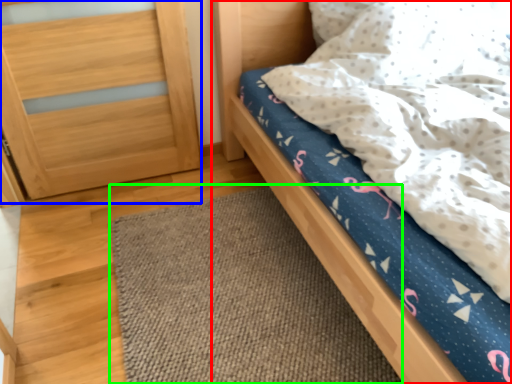
Question: Which is nearer to the bed (highlighted by a red box)? balustrade (highlighted by a blue box) or mat (highlighted by a green box).

Choices:
 (A) balustrade
 (B) mat

Answer: (B)